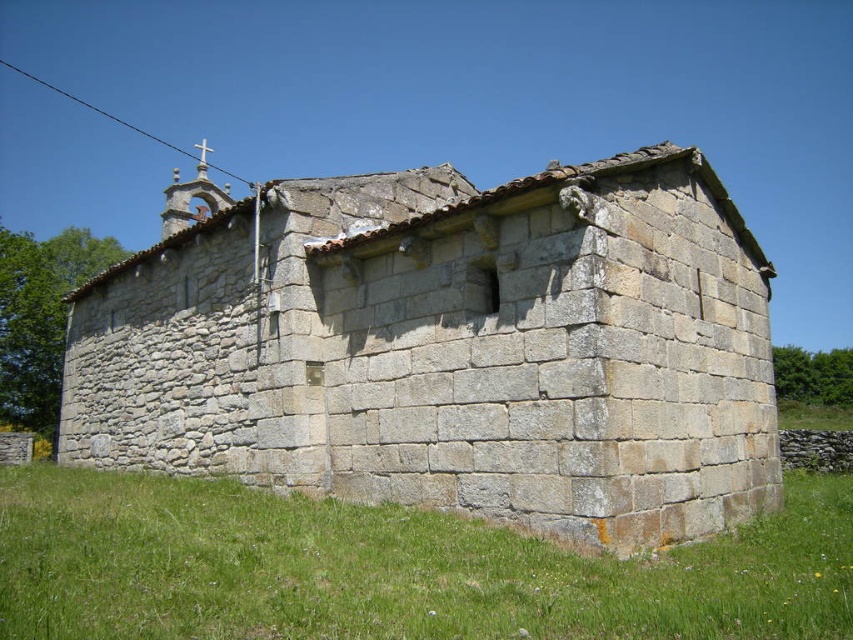
Based on the photo, you are standing at the lower right corner of the image, looking towards the gray stone church at center. Which direction should you walk to reach the green grass at lower right?

The gray stone church at center is above green grass at lower right, so you should walk towards the lower right direction to reach the green grass at lower right.

You are standing in a field and see the gray stone church at center. If you want to take a photo of it from exactly 100 feet away, should you move closer or farther away?

The gray stone church at center is currently 85.32 feet away from you. To reach 100 feet, you need to move farther away from the church.